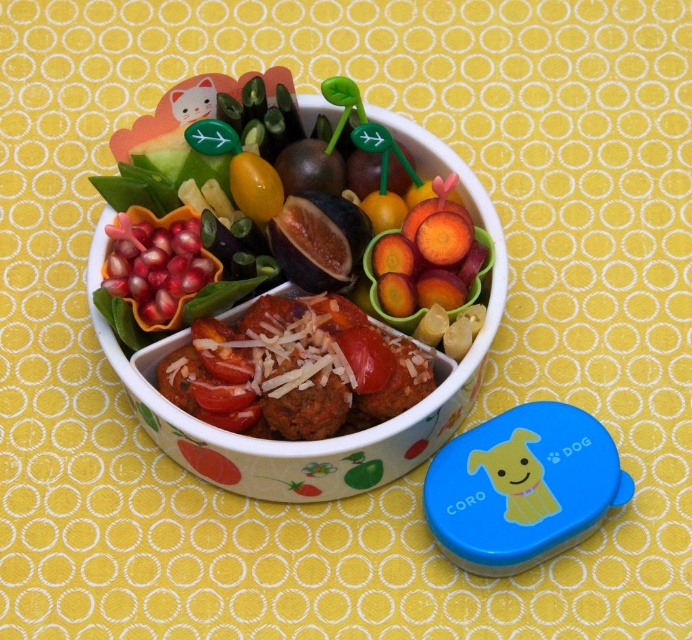
Question: Which of these objects is positioned closest to the white glossy bowl at center?

Choices:
 (A) brown matte meatballs at center
 (B) smooth orange carrot at center
 (C) blue plastic lid at lower right
 (D) pomegranate seeds at center

Answer: (A)

Question: Does brown matte meatballs at center appear over pomegranate seeds at center?

Choices:
 (A) no
 (B) yes

Answer: (A)

Question: In this image, where is white glossy bowl at center located relative to brown matte meatballs at center?

Choices:
 (A) right
 (B) left

Answer: (B)

Question: Which of these objects is positioned farthest from the blue plastic lid at lower right?

Choices:
 (A) smooth orange carrot at center
 (B) white glossy bowl at center
 (C) brown matte meatballs at center

Answer: (A)

Question: Which object is the farthest from the white glossy bowl at center?

Choices:
 (A) pomegranate seeds at center
 (B) brown matte meatballs at center
 (C) blue plastic lid at lower right
 (D) smooth orange carrot at center

Answer: (C)

Question: Can you confirm if blue plastic lid at lower right is smaller than smooth orange carrot at center?

Choices:
 (A) yes
 (B) no

Answer: (B)